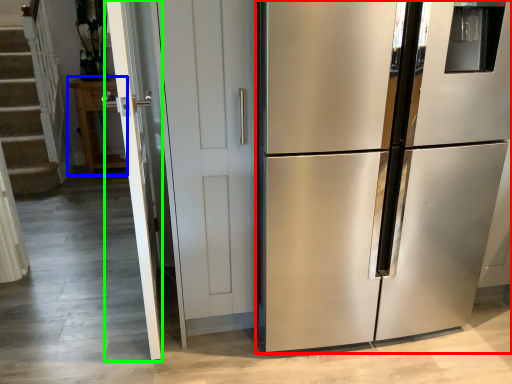
Question: Based on their relative distances, which object is nearer to refrigerator (highlighted by a red box)? Choose from cabinetry (highlighted by a blue box) and screen door (highlighted by a green box).

Choices:
 (A) cabinetry
 (B) screen door

Answer: (B)